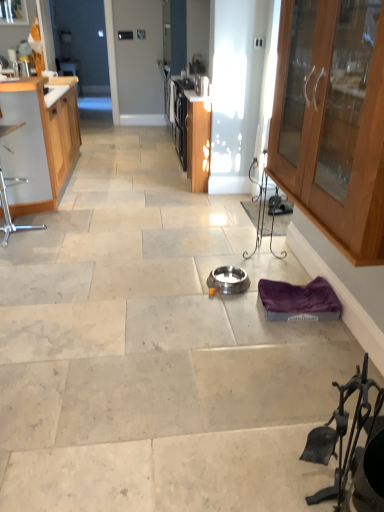
Question: Does metallic silver chair at left, the 2th chair when ordered from bottom to top, have a larger size compared to satin silver bowl at center, the 2th appliance in the top-to-bottom sequence?

Choices:
 (A) no
 (B) yes

Answer: (B)

Question: From a real-world perspective, is metallic silver chair at left, which is counted as the 1th chair, starting from the top, below satin silver bowl at center, which appears as the first appliance when viewed from the front?

Choices:
 (A) yes
 (B) no

Answer: (B)

Question: Does metallic silver chair at left, the 2th chair when ordered from bottom to top, have a greater height compared to satin silver bowl at center, the 1th appliance from the right?

Choices:
 (A) no
 (B) yes

Answer: (B)

Question: Can you confirm if metallic silver chair at left, positioned as the 2th chair in right-to-left order, is thinner than satin silver bowl at center, positioned as the first appliance in bottom-to-top order?

Choices:
 (A) no
 (B) yes

Answer: (A)

Question: Is metallic silver chair at left, which appears as the 1th chair when viewed from the left, smaller than satin silver bowl at center, the 2th appliance in the top-to-bottom sequence?

Choices:
 (A) no
 (B) yes

Answer: (A)

Question: Is metallic silver chair at left, positioned as the first chair in back-to-front order, in front of or behind metallic stainless steel toaster at upper center, which is the second appliance from front to back, in the image?

Choices:
 (A) behind
 (B) front

Answer: (B)

Question: In terms of width, does metallic silver chair at left, the 2th chair when ordered from bottom to top, look wider or thinner when compared to metallic stainless steel toaster at upper center, which appears as the second appliance when viewed from the right?

Choices:
 (A) thin
 (B) wide

Answer: (B)

Question: From a real-world perspective, is metallic silver chair at left, positioned as the 2th chair in right-to-left order, physically located above or below metallic stainless steel toaster at upper center, which is the first appliance in top-to-bottom order?

Choices:
 (A) above
 (B) below

Answer: (B)

Question: From the image's perspective, relative to metallic stainless steel toaster at upper center, which appears as the second appliance when viewed from the right, is metallic silver chair at left, positioned as the first chair in back-to-front order, above or below?

Choices:
 (A) below
 (B) above

Answer: (A)

Question: Is wooden cabinet at left, the second cabinetry from the right, in front of or behind satin silver bowl at center, which appears as the first appliance when viewed from the front, in the image?

Choices:
 (A) front
 (B) behind

Answer: (B)

Question: From a real-world perspective, is wooden cabinet at left, acting as the first cabinetry starting from the back, positioned above or below satin silver bowl at center, the second appliance viewed from the left?

Choices:
 (A) above
 (B) below

Answer: (A)

Question: Visually, is wooden cabinet at left, acting as the first cabinetry starting from the back, positioned to the left or to the right of satin silver bowl at center, arranged as the second appliance when viewed from the back?

Choices:
 (A) left
 (B) right

Answer: (A)

Question: From the image's perspective, is wooden cabinet at left, arranged as the first cabinetry when viewed from the left, above or below satin silver bowl at center, which appears as the first appliance when viewed from the front?

Choices:
 (A) below
 (B) above

Answer: (B)

Question: In the image, is metallic silver chair at left, the second chair from the front, positioned in front of or behind wooden cabinet at left, the 2th cabinetry positioned from the front?

Choices:
 (A) behind
 (B) front

Answer: (B)

Question: Looking at the image, does metallic silver chair at left, positioned as the first chair in back-to-front order, seem bigger or smaller compared to wooden cabinet at left, acting as the first cabinetry starting from the back?

Choices:
 (A) small
 (B) big

Answer: (A)